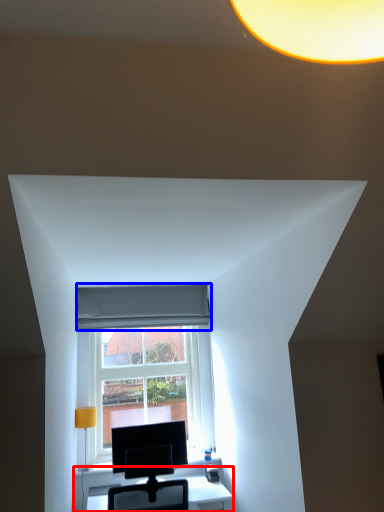
Question: Among these objects, which one is nearest to the camera, table (highlighted by a red box) or curtain (highlighted by a blue box)?

Choices:
 (A) table
 (B) curtain

Answer: (A)